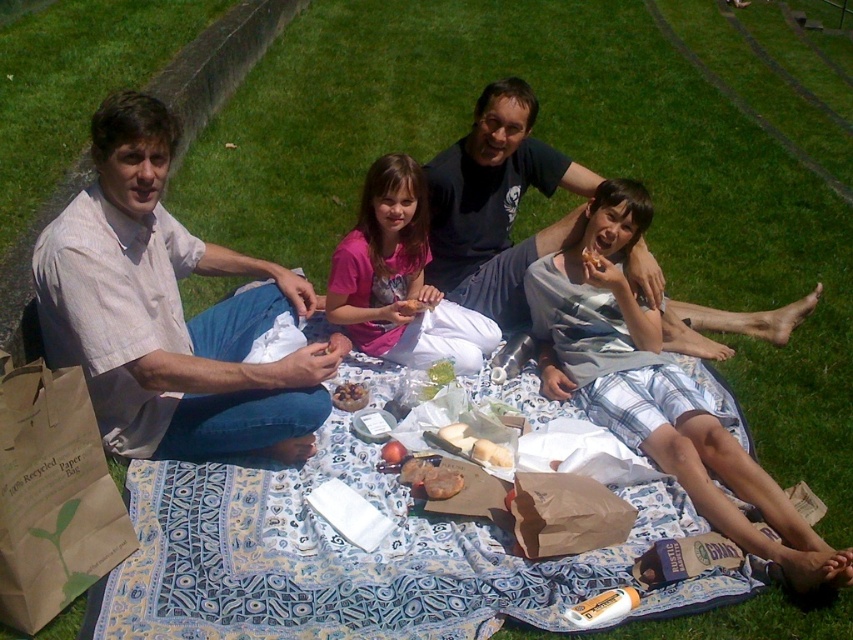
Is white crumbly bread at center closer to camera compared to smooth apple at center?

Yes, white crumbly bread at center is closer to the viewer.

Is point (482, 442) behind point (392, 444)?

No.

Who is more distant from viewer, [503,458] or [393,456]?

The point [393,456] is more distant.

The height and width of the screenshot is (640, 853). I want to click on white crumbly bread at center, so click(491, 452).

Is smooth chocolate bar at center above smooth white bread at center?

Actually, smooth chocolate bar at center is below smooth white bread at center.

The width and height of the screenshot is (853, 640). In order to click on smooth chocolate bar at center in this screenshot , I will do `click(350, 396)`.

Between light beige cotton shirt at left and pink fabric at center, which one appears on the left side from the viewer's perspective?

light beige cotton shirt at left

Is the position of light beige cotton shirt at left more distant than that of pink fabric at center?

No, it is in front of pink fabric at center.

Is point (155, 220) behind point (396, 317)?

No.

The image size is (853, 640). I want to click on light beige cotton shirt at left, so click(167, 312).